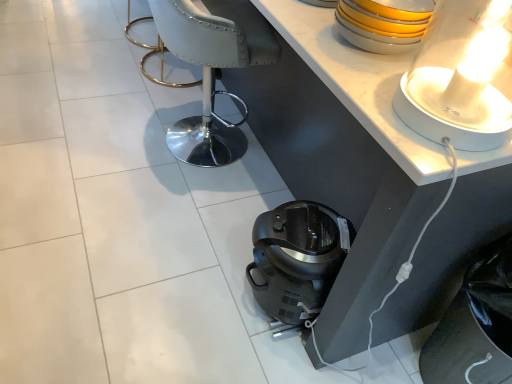
You are a GUI agent. You are given a task and a screenshot of the screen. Output one action in this format:
    pyautogui.click(x=<x>, y=<y>)
    Task: Click on the vacant space in white leather armchair at center (from a real-world perspective)
    Image resolution: width=512 pixels, height=384 pixels.
    Given the screenshot: What is the action you would take?
    pyautogui.click(x=181, y=134)